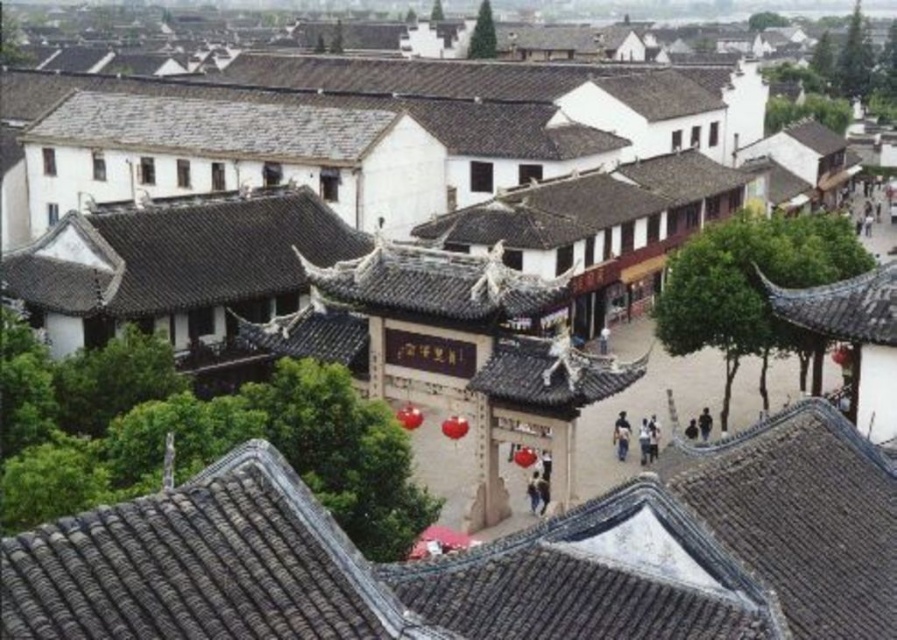
Is gray tile roof at center closer to the viewer compared to shiny dark gray roof at upper right?

Yes, gray tile roof at center is in front of shiny dark gray roof at upper right.

Can you confirm if gray tile roof at center is thinner than shiny dark gray roof at upper right?

In fact, gray tile roof at center might be wider than shiny dark gray roof at upper right.

Which is in front, point (68, 628) or point (863, 316)?

Point (68, 628)

Identify the location of gray tile roof at center. This screenshot has height=640, width=897. (490, 556).